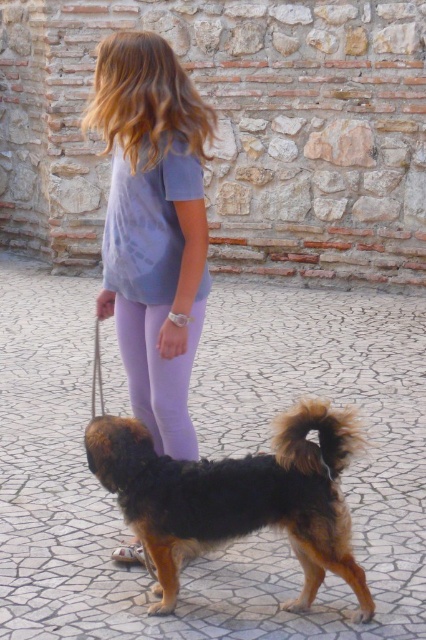
Question: Which point is closer to the camera taking this photo?

Choices:
 (A) (109, 435)
 (B) (160, 374)

Answer: (A)

Question: Does brown fur dog at lower center come in front of purple leggings at center?

Choices:
 (A) no
 (B) yes

Answer: (B)

Question: Does purple cotton shirt at upper center have a greater width compared to purple leggings at center?

Choices:
 (A) no
 (B) yes

Answer: (B)

Question: In this image, where is purple cotton shirt at upper center located relative to brown fur dog at lower center?

Choices:
 (A) left
 (B) right

Answer: (A)

Question: Considering the real-world distances, which object is closest to the purple cotton shirt at upper center?

Choices:
 (A) purple leggings at center
 (B) brown fur dog at lower center

Answer: (A)

Question: Among these objects, which one is farthest from the camera?

Choices:
 (A) purple cotton shirt at upper center
 (B) brown fur dog at lower center

Answer: (A)